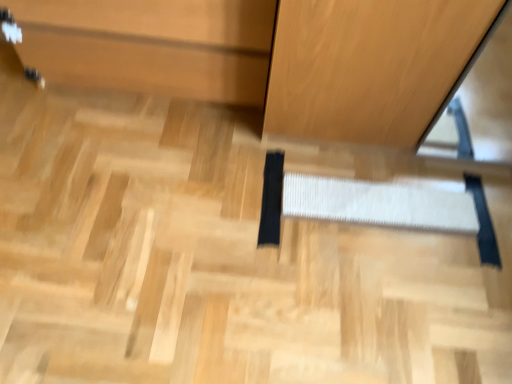
Question: Is white woven stair at center turned away from matte wood cabinet at upper left?

Choices:
 (A) no
 (B) yes

Answer: (A)

Question: From the image's perspective, is white woven stair at center beneath matte wood cabinet at upper left?

Choices:
 (A) yes
 (B) no

Answer: (A)

Question: From the image's perspective, is white woven stair at center on matte wood cabinet at upper left?

Choices:
 (A) yes
 (B) no

Answer: (B)

Question: Can you confirm if white woven stair at center is shorter than matte wood cabinet at upper left?

Choices:
 (A) no
 (B) yes

Answer: (B)

Question: Considering the relative sizes of white woven stair at center and matte wood cabinet at upper left in the image provided, is white woven stair at center wider than matte wood cabinet at upper left?

Choices:
 (A) no
 (B) yes

Answer: (A)

Question: Is white woven stair at center oriented towards matte wood cabinet at upper left?

Choices:
 (A) yes
 (B) no

Answer: (B)

Question: Can white woven stair at center be found inside matte wood cabinet at upper left?

Choices:
 (A) no
 (B) yes

Answer: (A)

Question: Can you confirm if matte wood cabinet at upper left is positioned to the left of white woven stair at center?

Choices:
 (A) no
 (B) yes

Answer: (B)

Question: From the image's perspective, does matte wood cabinet at upper left appear higher than white woven stair at center?

Choices:
 (A) yes
 (B) no

Answer: (A)

Question: Does matte wood cabinet at upper left have a larger size compared to white woven stair at center?

Choices:
 (A) yes
 (B) no

Answer: (A)

Question: Does matte wood cabinet at upper left have a lesser width compared to white woven stair at center?

Choices:
 (A) yes
 (B) no

Answer: (B)

Question: Does matte wood cabinet at upper left come in front of white woven stair at center?

Choices:
 (A) no
 (B) yes

Answer: (B)

Question: Is matte wood cabinet at upper left spatially inside white woven stair at center, or outside of it?

Choices:
 (A) outside
 (B) inside

Answer: (A)